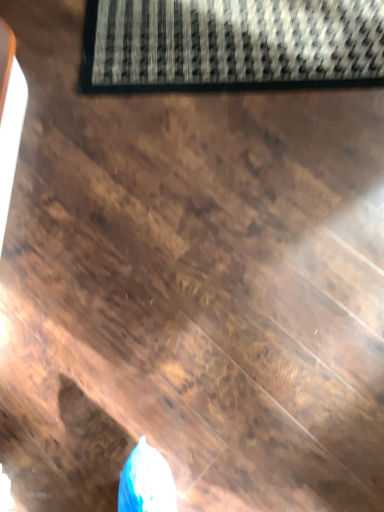
In order to click on vacant region above black textured mat at upper center (from a real-world perspective) in this screenshot , I will do `click(168, 26)`.